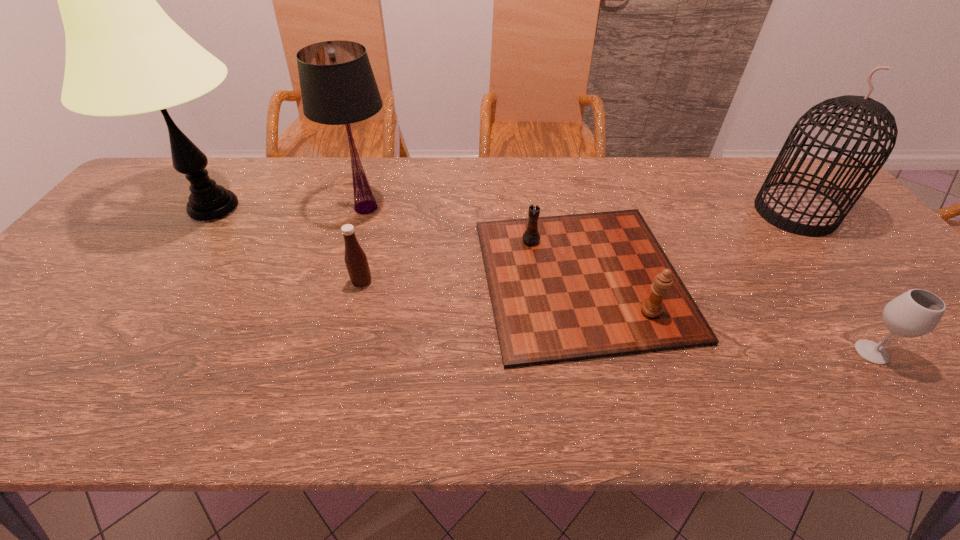
Where is `vacant space located on the left of the Tabasco sauce`? vacant space located on the left of the Tabasco sauce is located at coordinates (229, 282).

What are the coordinates of `free space located 0.060m on the left of the wineglass` in the screenshot? It's located at tap(825, 352).

I want to click on free space located 0.260m on the right of the third object from right to left, so click(x=791, y=278).

You are a GUI agent. You are given a task and a screenshot of the screen. Output one action in this format:
    pyautogui.click(x=<x>, y=<y>)
    Task: Click on the lamp at the far edge
    
    Given the screenshot: What is the action you would take?
    tap(124, 55)

Image resolution: width=960 pixels, height=540 pixels. What are the coordinates of `lampshade that is at the far edge` in the screenshot? It's located at (338, 87).

Locate an element on the screen. This screenshot has width=960, height=540. birdcage at the far edge is located at coordinates (799, 209).

Find the location of a particular element. This screenshot has width=960, height=540. object located at the left edge is located at coordinates (124, 55).

Locate an element on the screen. Image resolution: width=960 pixels, height=540 pixels. object that is positioned at the right edge is located at coordinates (799, 209).

Identify the location of object that is at the far left corner. The height and width of the screenshot is (540, 960). (124, 55).

In order to click on object positioned at the far right corner in this screenshot , I will do `click(799, 209)`.